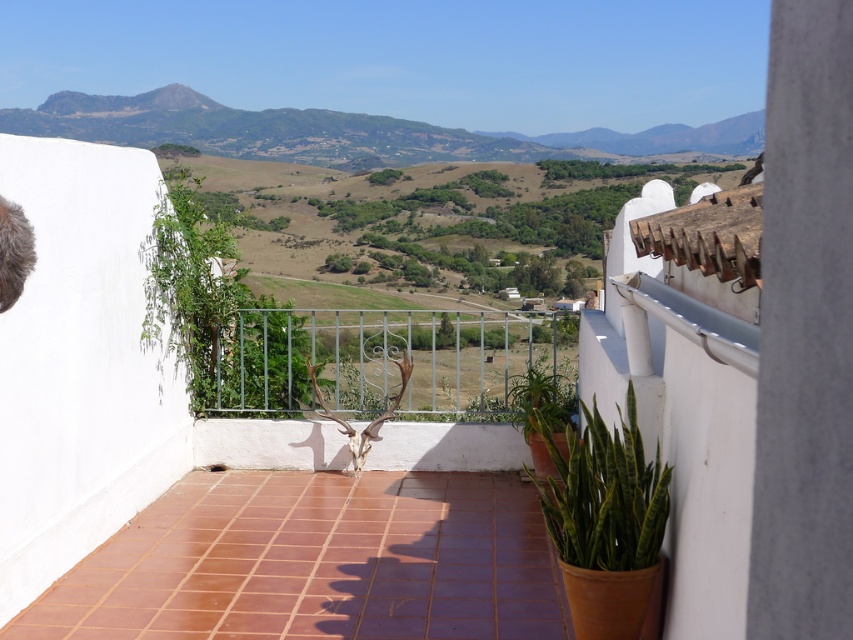
Question: Is terracotta tile terrace at center wider than rugged brown mountain at upper center?

Choices:
 (A) no
 (B) yes

Answer: (A)

Question: Which of the following is the farthest from the observer?

Choices:
 (A) green glossy snake plant at lower right
 (B) terracotta tile terrace at center
 (C) rugged brown mountain at upper center

Answer: (C)

Question: Which of the following is the closest to the observer?

Choices:
 (A) (585, 522)
 (B) (146, 371)

Answer: (A)

Question: Which of the following is the closest to the observer?

Choices:
 (A) (190, 445)
 (B) (518, 144)
 (C) (627, 481)

Answer: (C)

Question: Can you confirm if terracotta tile terrace at center is positioned to the right of green glossy snake plant at lower right?

Choices:
 (A) yes
 (B) no

Answer: (B)

Question: Can you confirm if terracotta tile terrace at center is positioned above rugged brown mountain at upper center?

Choices:
 (A) yes
 (B) no

Answer: (B)